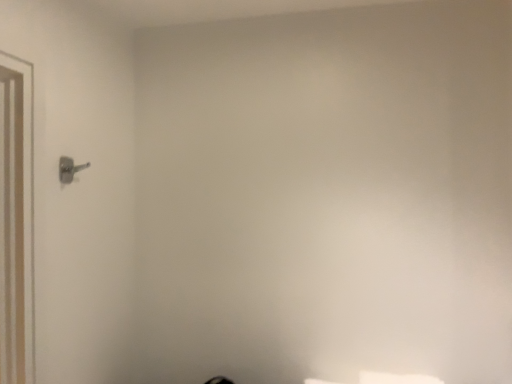
Measure the distance between satin silver door handle at upper left and camera.

satin silver door handle at upper left is 3.86 feet away from camera.

What do you see at coordinates (69, 169) in the screenshot?
I see `satin silver door handle at upper left` at bounding box center [69, 169].

At what (x,y) coordinates should I click in order to perform the action: click on satin silver door handle at upper left. Please return your answer as a coordinate pair (x, y). This screenshot has width=512, height=384. Looking at the image, I should click on (69, 169).

Locate an element on the screen. The image size is (512, 384). satin silver door handle at upper left is located at coordinates click(69, 169).